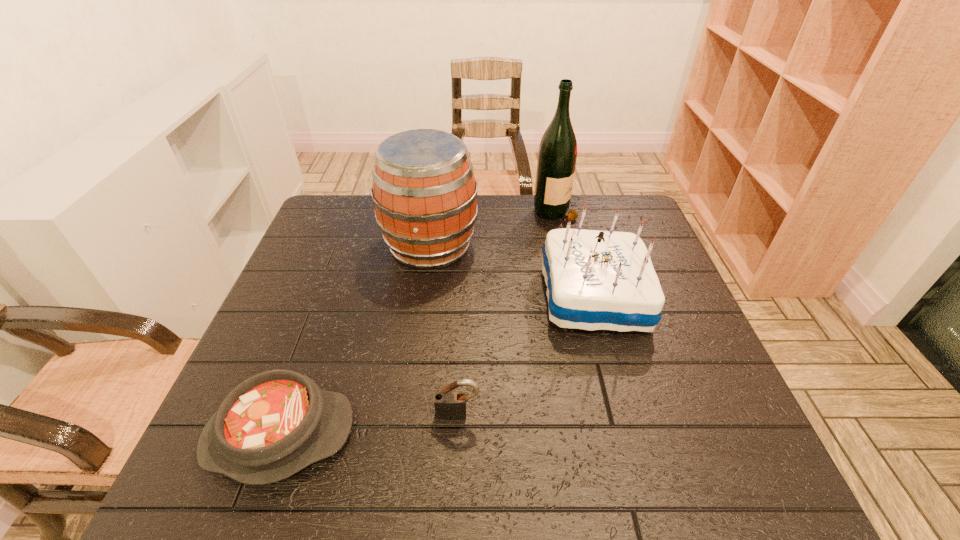
You are a GUI agent. You are given a task and a screenshot of the screen. Output one action in this format:
    pyautogui.click(x=<x>, y=<y>)
    Task: Click on the third closest object to the second tallest object
    The width and height of the screenshot is (960, 540).
    Given the screenshot: What is the action you would take?
    pyautogui.click(x=274, y=424)

Identify which object is located as the fourth nearest to the shortest object. Please provide its 2D coordinates. Your answer should be formatted as a tuple, i.e. [(x, y)], where the tuple contains the x and y coordinates of a point satisfying the conditions above.

[(557, 154)]

Find the location of a particular element. free space that satisfies the following two spatial constraints: 1. on the front side of the third shortest object; 2. on the left side of the cider is located at coordinates (423, 297).

This screenshot has height=540, width=960. What are the coordinates of `free space that satisfies the following two spatial constraints: 1. on the back side of the wine bottle; 2. on the left side of the second tallest object` in the screenshot? It's located at (435, 211).